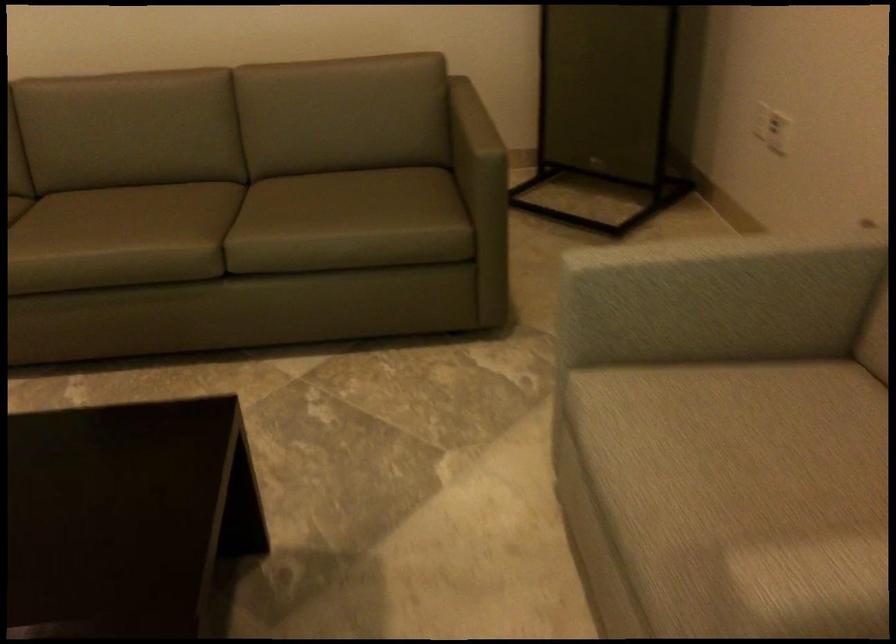
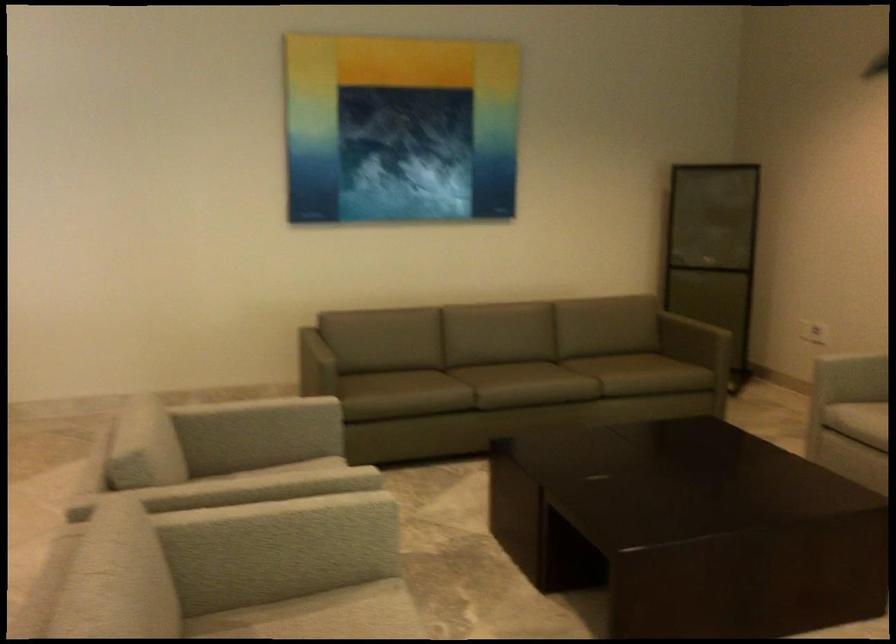
In the second image, find the point that corresponds to (90,266) in the first image.

(524, 384)